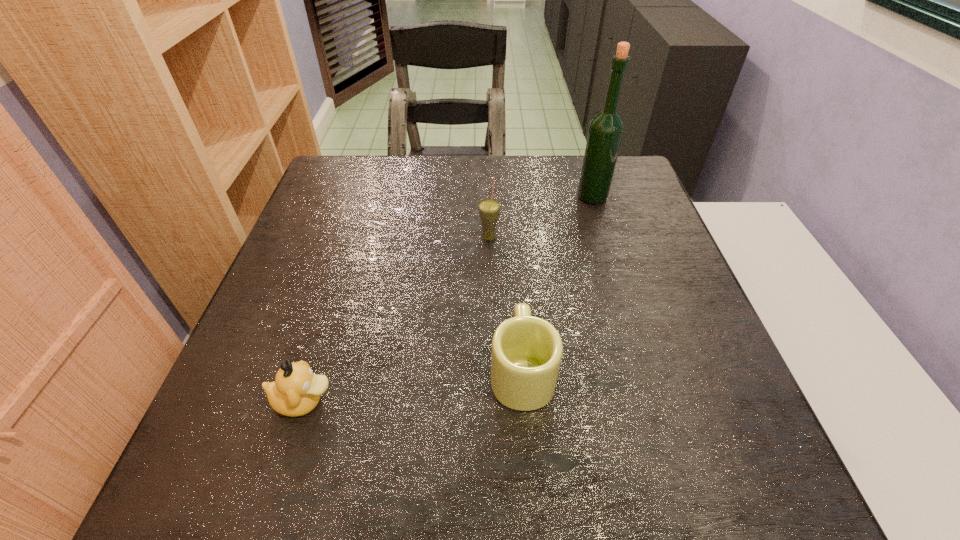
Where is `vacant space located with the handle on the side of the mug`? vacant space located with the handle on the side of the mug is located at coordinates (516, 303).

Locate an element on the screen. free region located 0.070m on the face of the leftmost object is located at coordinates (375, 401).

Image resolution: width=960 pixels, height=540 pixels. I want to click on object located at the far edge, so click(x=606, y=129).

Identify the location of object positioned at the left edge. (296, 391).

The image size is (960, 540). I want to click on object located at the right edge, so click(x=606, y=129).

This screenshot has width=960, height=540. Identify the location of object that is positioned at the far right corner. (606, 129).

Where is `free location at the far edge of the desktop`? Image resolution: width=960 pixels, height=540 pixels. free location at the far edge of the desktop is located at coordinates point(468,155).

At what (x,y) coordinates should I click in order to perform the action: click on vacant space at the near edge of the desktop. Please return your answer as a coordinate pair (x, y). This screenshot has width=960, height=540. Looking at the image, I should click on (315, 481).

Where is `vacant space at the left edge of the desktop`? The image size is (960, 540). vacant space at the left edge of the desktop is located at coordinates (323, 357).

This screenshot has height=540, width=960. In order to click on vacant point at the right edge in this screenshot , I will do `click(672, 356)`.